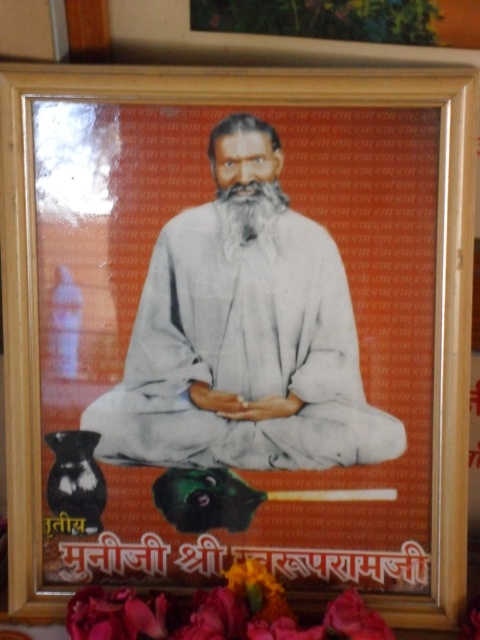
You are standing in front of the framed photograph described in the scene. There is a point marked at coordinates (242, 336). What object is located at this point?

The point at coordinates (242, 336) corresponds to the white cloth at center.

You are a florist arranging flowers under a framed photo. The photo shows a spiritual figure with a white soft beard at center and silky pink petals at lower center are placed below. Can you tell me which one is shorter in height?

The silky pink petals at lower center is shorter than the white soft beard at center.

You are arranging flowers for a ceremony and have a white cloth at center and silky pink petals at lower center. Which item has a greater width?

The white cloth at center has a greater width than the silky pink petals at lower center.